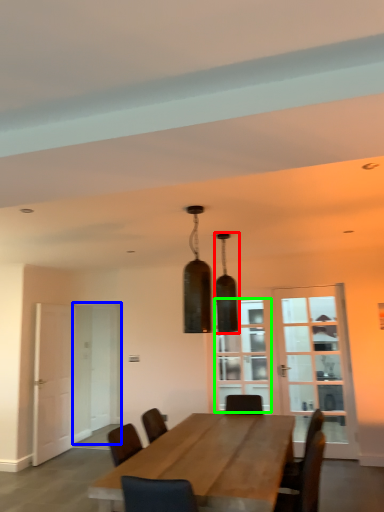
Question: Based on their relative distances, which object is nearer to lamp (highlighted by a red box)? Choose from glass door (highlighted by a blue box) and window (highlighted by a green box).

Choices:
 (A) glass door
 (B) window

Answer: (B)